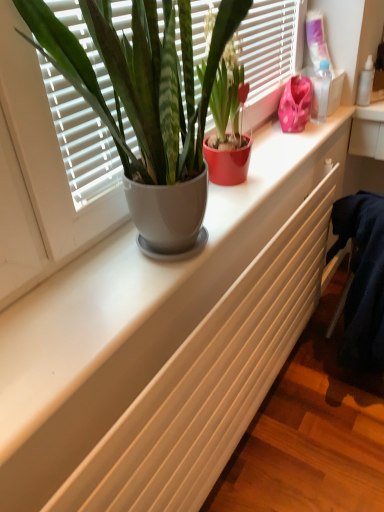
This screenshot has height=512, width=384. Describe the element at coordinates (320, 92) in the screenshot. I see `transparent plastic bottle at upper right, acting as the 2th toiletry starting from the back` at that location.

This screenshot has height=512, width=384. What do you see at coordinates (223, 102) in the screenshot? I see `matte ceramic pot at center, the second houseplant when ordered from left to right` at bounding box center [223, 102].

The image size is (384, 512). What do you see at coordinates (210, 380) in the screenshot?
I see `white matte radiator at center` at bounding box center [210, 380].

Locate an element on the screen. Image resolution: width=384 pixels, height=512 pixels. clear plastic spray bottle at upper right, placed as the 2th toiletry when sorted from left to right is located at coordinates tap(366, 83).

Is matte ceramic pot at center, arranged as the 1th houseplant when viewed from the right, oriented towards white matte radiator at center?

No, matte ceramic pot at center, arranged as the 1th houseplant when viewed from the right, is not turned towards white matte radiator at center.

In the scene shown: From a real-world perspective, between matte ceramic pot at center, the second houseplant when ordered from left to right, and white matte radiator at center, who is vertically lower?

white matte radiator at center.

Which object is more forward, matte ceramic pot at center, the second houseplant when ordered from left to right, or white matte radiator at center?

white matte radiator at center is closer to the camera.

Would you say transparent plastic bottle at upper right, the first toiletry in the left-to-right sequence, is a long distance from matte ceramic pot at center, arranged as the 1th houseplant when viewed from the right?

They are positioned close to each other.

Image resolution: width=384 pixels, height=512 pixels. In order to click on the 1st toiletry behind the matte ceramic pot at center, arranged as the 1th houseplant when viewed from the right in this screenshot , I will do `click(320, 92)`.

Who is smaller, transparent plastic bottle at upper right, acting as the 2th toiletry starting from the back, or matte ceramic pot at center, arranged as the 1th houseplant when viewed from the right?

Smaller between the two is transparent plastic bottle at upper right, acting as the 2th toiletry starting from the back.

From a real-world perspective, relative to matte ceramic pot at center, the second houseplant when ordered from left to right, is transparent plastic bottle at upper right, the first toiletry in the left-to-right sequence, vertically above or below?

In terms of real-world spatial position, transparent plastic bottle at upper right, the first toiletry in the left-to-right sequence, is below matte ceramic pot at center, the second houseplant when ordered from left to right.

Does point (368, 99) come behind point (330, 96)?

Yes.

Does clear plastic spray bottle at upper right, which appears as the 2th toiletry when viewed from the front, have a greater width compared to pink fabric at upper right?

No, clear plastic spray bottle at upper right, which appears as the 2th toiletry when viewed from the front, is not wider than pink fabric at upper right.

Can pink fabric at upper right be found inside clear plastic spray bottle at upper right, the 1th toiletry viewed from the right?

Actually, pink fabric at upper right is outside clear plastic spray bottle at upper right, the 1th toiletry viewed from the right.

Image resolution: width=384 pixels, height=512 pixels. In order to click on window box on the right of white matte radiator at center in this screenshot , I will do `click(335, 91)`.

Consider the image. Is pink fabric at upper right bigger than white matte radiator at center?

Actually, pink fabric at upper right might be smaller than white matte radiator at center.

Consider the image. From the image's perspective, is pink fabric at upper right on top of white matte radiator at center?

Yes, from the image's perspective, pink fabric at upper right is over white matte radiator at center.

Who is taller, pink fabric at upper right or white matte radiator at center?

white matte radiator at center.

Considering the positions of objects transparent plastic bottle at upper right, which is the 1th toiletry from front to back, and pink fabric at upper right in the image provided, who is behind, transparent plastic bottle at upper right, which is the 1th toiletry from front to back, or pink fabric at upper right?

pink fabric at upper right is more distant.

In the scene shown: In terms of size, does transparent plastic bottle at upper right, the first toiletry in the left-to-right sequence, appear bigger or smaller than pink fabric at upper right?

In the image, transparent plastic bottle at upper right, the first toiletry in the left-to-right sequence, appears to be smaller than pink fabric at upper right.

From the image's perspective, who appears lower, transparent plastic bottle at upper right, acting as the 2th toiletry starting from the back, or pink fabric at upper right?

transparent plastic bottle at upper right, acting as the 2th toiletry starting from the back.

Does transparent plastic bottle at upper right, acting as the 2th toiletry starting from the back, appear on the right side of pink fabric at upper right?

Incorrect, transparent plastic bottle at upper right, acting as the 2th toiletry starting from the back, is not on the right side of pink fabric at upper right.

Choose the correct answer: Is white matte radiator at center inside matte white pot at upper left, arranged as the 1th houseplant when viewed from the left, or outside it?

white matte radiator at center is spatially situated outside matte white pot at upper left, arranged as the 1th houseplant when viewed from the left.

Which is in front, white matte radiator at center or matte white pot at upper left, which appears as the second houseplant when viewed from the right?

white matte radiator at center.

From a real-world perspective, is white matte radiator at center above or below matte white pot at upper left, arranged as the 1th houseplant when viewed from the left?

white matte radiator at center is below matte white pot at upper left, arranged as the 1th houseplant when viewed from the left.

Who is bigger, white matte radiator at center or pink fabric at upper right?

Bigger between the two is white matte radiator at center.

From a real-world perspective, who is located higher, white matte radiator at center or pink fabric at upper right?

pink fabric at upper right, from a real-world perspective.

Is white matte radiator at center positioned beyond the bounds of pink fabric at upper right?

Yes, white matte radiator at center is located beyond the bounds of pink fabric at upper right.

Can you tell me how much white matte radiator at center and pink fabric at upper right differ in facing direction?

The angular difference between white matte radiator at center and pink fabric at upper right is 3.12 degrees.

Locate an element on the screen. the 1st houseplant above when counting from the white matte radiator at center (from the image's perspective) is located at coordinates (223, 102).

This screenshot has height=512, width=384. There is a transparent plastic bottle at upper right, which is the 1th toiletry from front to back. What are the coordinates of `the 1st houseplant above it (from a real-world perspective)` in the screenshot? It's located at (223, 102).

Considering their positions, is transparent plastic bottle at upper right, the first toiletry in the left-to-right sequence, positioned further to white matte radiator at center than clear plastic spray bottle at upper right, placed as the 2th toiletry when sorted from left to right?

clear plastic spray bottle at upper right, placed as the 2th toiletry when sorted from left to right, lies further to white matte radiator at center than the other object.

When comparing their distances from clear plastic spray bottle at upper right, the 1th toiletry positioned from the back, does transparent plastic bottle at upper right, acting as the 2th toiletry starting from the back, or matte ceramic pot at center, the second houseplant when ordered from left to right, seem closer?

transparent plastic bottle at upper right, acting as the 2th toiletry starting from the back, lies closer to clear plastic spray bottle at upper right, the 1th toiletry positioned from the back, than the other object.

Based on their spatial positions, is pink fabric at upper right or clear plastic spray bottle at upper right, which appears as the 2th toiletry when viewed from the front, further from matte ceramic pot at center, arranged as the 1th houseplant when viewed from the right?

clear plastic spray bottle at upper right, which appears as the 2th toiletry when viewed from the front, is positioned further to the anchor matte ceramic pot at center, arranged as the 1th houseplant when viewed from the right.

Considering their positions, is pink fabric at upper right positioned further to transparent plastic bottle at upper right, the first toiletry in the left-to-right sequence, than matte ceramic pot at center, arranged as the 1th houseplant when viewed from the right?

matte ceramic pot at center, arranged as the 1th houseplant when viewed from the right.

From the picture: Based on their spatial positions, is matte white pot at upper left, arranged as the 1th houseplant when viewed from the left, or transparent plastic bottle at upper right, the 2th toiletry when ordered from right to left, further from clear plastic spray bottle at upper right, which appears as the 2th toiletry when viewed from the front?

matte white pot at upper left, arranged as the 1th houseplant when viewed from the left, lies further to clear plastic spray bottle at upper right, which appears as the 2th toiletry when viewed from the front, than the other object.

From the image, which object appears to be farther from matte ceramic pot at center, arranged as the 1th houseplant when viewed from the right, transparent plastic bottle at upper right, the first toiletry in the left-to-right sequence, or matte white pot at upper left, which appears as the second houseplant when viewed from the right?

Based on the image, transparent plastic bottle at upper right, the first toiletry in the left-to-right sequence, appears to be further to matte ceramic pot at center, arranged as the 1th houseplant when viewed from the right.

Which object lies nearer to the anchor point pink fabric at upper right, clear plastic spray bottle at upper right, which appears as the 2th toiletry when viewed from the front, or transparent plastic bottle at upper right, which is the 1th toiletry from front to back?

transparent plastic bottle at upper right, which is the 1th toiletry from front to back, is positioned closer to the anchor pink fabric at upper right.

Looking at the image, which one is located closer to transparent plastic bottle at upper right, acting as the 2th toiletry starting from the back, matte white pot at upper left, arranged as the 1th houseplant when viewed from the left, or clear plastic spray bottle at upper right, the 1th toiletry positioned from the back?

Based on the image, clear plastic spray bottle at upper right, the 1th toiletry positioned from the back, appears to be nearer to transparent plastic bottle at upper right, acting as the 2th toiletry starting from the back.

The image size is (384, 512). Find the location of `houseplant between matte white pot at upper left, arranged as the 1th houseplant when viewed from the left, and clear plastic spray bottle at upper right, placed as the 2th toiletry when sorted from left to right, in the front-back direction`. houseplant between matte white pot at upper left, arranged as the 1th houseplant when viewed from the left, and clear plastic spray bottle at upper right, placed as the 2th toiletry when sorted from left to right, in the front-back direction is located at coordinates (223, 102).

Find the location of a particular element. The image size is (384, 512). toiletry between white matte radiator at center and pink fabric at upper right in the front-back direction is located at coordinates (320, 92).

At what (x,y) coordinates should I click in order to perform the action: click on toiletry between matte white pot at upper left, which appears as the second houseplant when viewed from the right, and clear plastic spray bottle at upper right, the 1th toiletry viewed from the right, in the front-back direction. Please return your answer as a coordinate pair (x, y). Looking at the image, I should click on (320, 92).

Where is `toiletry located between matte ceramic pot at center, arranged as the 1th houseplant when viewed from the right, and clear plastic spray bottle at upper right, the 1th toiletry positioned from the back, in the depth direction`? This screenshot has width=384, height=512. toiletry located between matte ceramic pot at center, arranged as the 1th houseplant when viewed from the right, and clear plastic spray bottle at upper right, the 1th toiletry positioned from the back, in the depth direction is located at coordinates (320, 92).